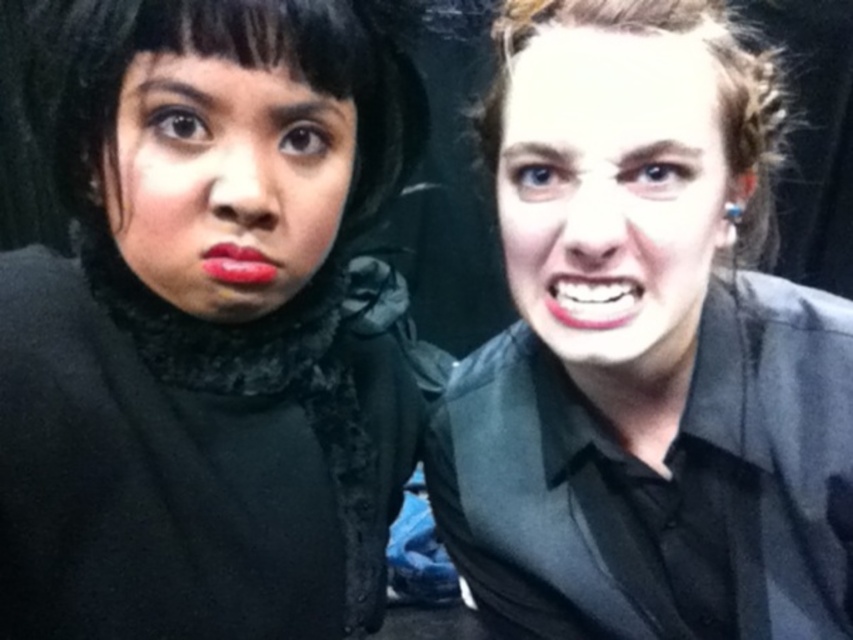
Can you confirm if black matte shirt at right is smaller than matte red lips at center?

Incorrect, black matte shirt at right is not smaller in size than matte red lips at center.

Is point (764, 456) farther from viewer compared to point (236, 268)?

Yes, it is.

Find the location of a particular element. The width and height of the screenshot is (853, 640). black matte shirt at right is located at coordinates (646, 352).

Between smooth skin face at right and matte black face at upper left, which one appears on the right side from the viewer's perspective?

From the viewer's perspective, smooth skin face at right appears more on the right side.

Does smooth skin face at right lie in front of matte black face at upper left?

No.

You are a GUI agent. You are given a task and a screenshot of the screen. Output one action in this format:
    pyautogui.click(x=<x>, y=<y>)
    Task: Click on the smooth skin face at right
    The height and width of the screenshot is (640, 853).
    Given the screenshot: What is the action you would take?
    pyautogui.click(x=612, y=193)

Locate an element on the screen. The height and width of the screenshot is (640, 853). smooth skin face at right is located at coordinates (612, 193).

Is black lace top at upper left positioned behind matte red lips at center?

No, black lace top at upper left is closer to the viewer.

Describe the element at coordinates (210, 323) in the screenshot. Image resolution: width=853 pixels, height=640 pixels. I see `black lace top at upper left` at that location.

Where is `black lace top at upper left`? black lace top at upper left is located at coordinates (210, 323).

This screenshot has width=853, height=640. I want to click on black lace top at upper left, so click(x=210, y=323).